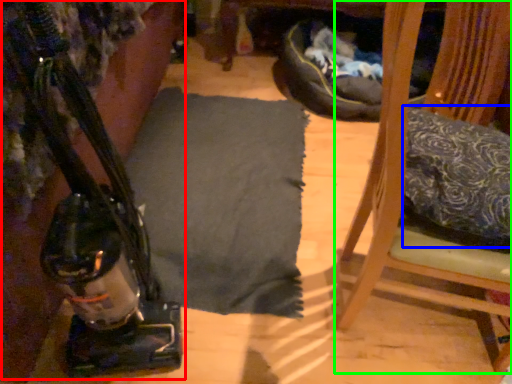
Question: Which is nearer to the job (highlighted by a red box)? pillow (highlighted by a blue box) or furniture (highlighted by a green box).

Choices:
 (A) pillow
 (B) furniture

Answer: (B)